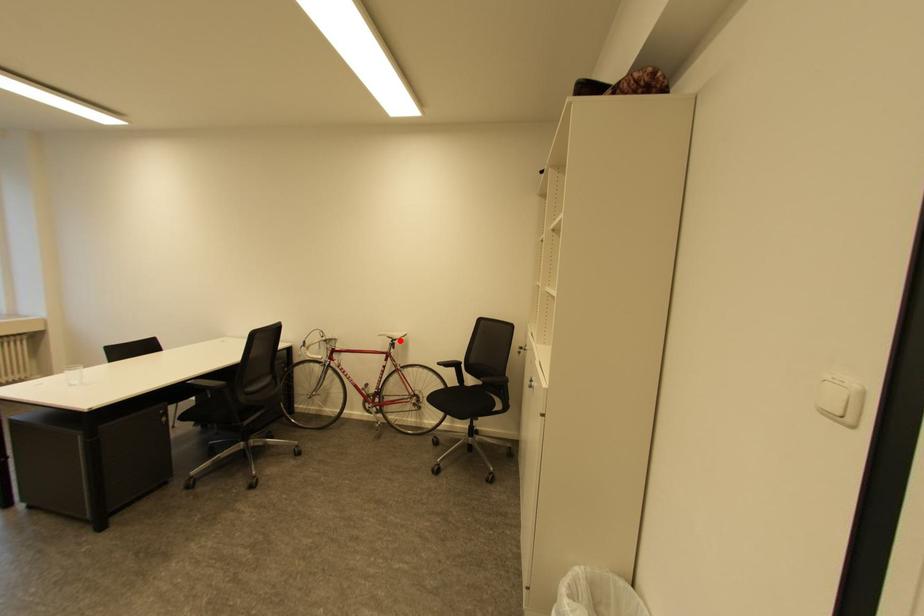
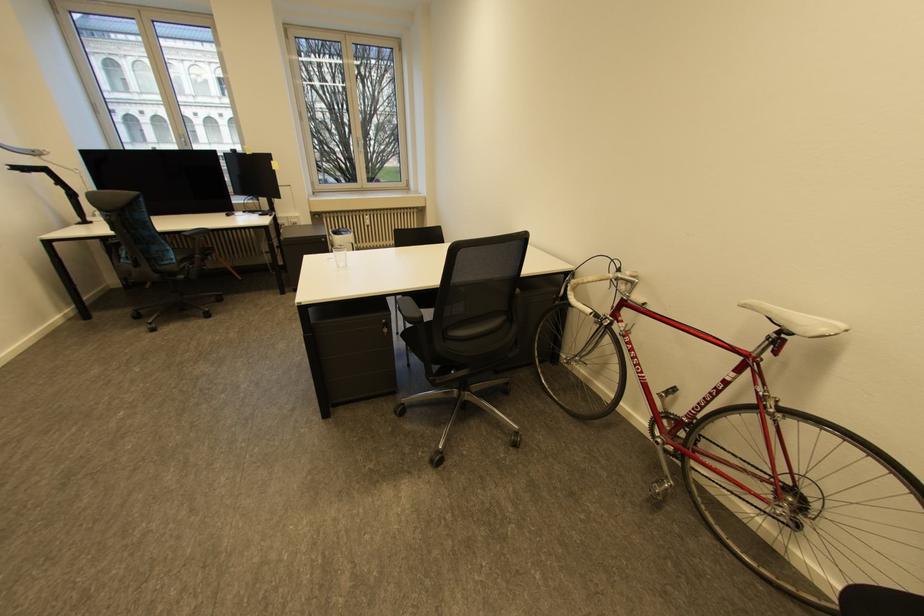
The point at the highlighted location is marked in the first image. Where is the corresponding point in the second image?

(789, 331)